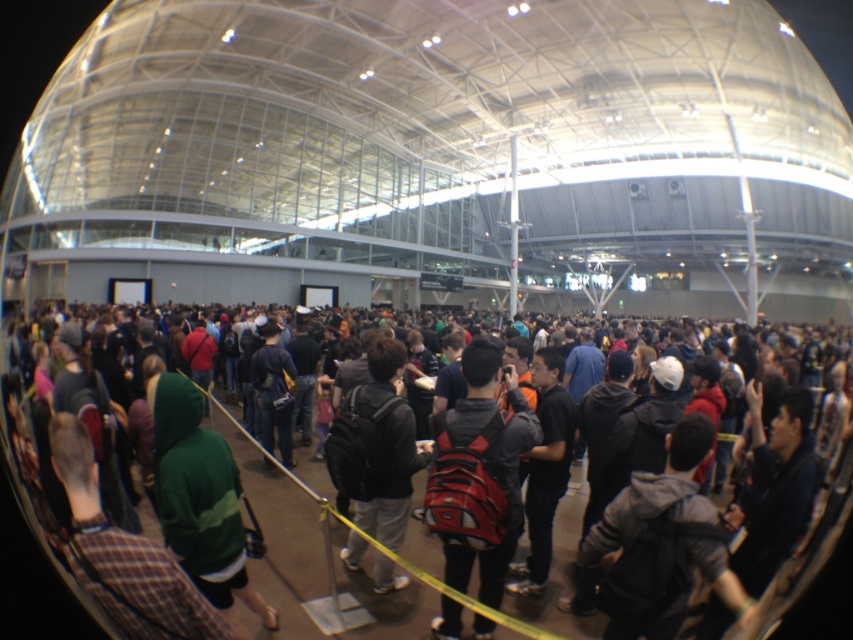
Question: Which point appears farthest from the camera in this image?

Choices:
 (A) (485, 422)
 (B) (358, 432)
 (C) (291, 579)

Answer: (C)

Question: Estimate the real-world distances between objects in this image. Which object is farther from the dark green hoodie at center?

Choices:
 (A) dark gray backpack at center
 (B) red backpack at center

Answer: (B)

Question: Can you confirm if dark green hoodie at center is positioned below red backpack at center?

Choices:
 (A) no
 (B) yes

Answer: (B)

Question: Is dark green hoodie at center above dark gray backpack at center?

Choices:
 (A) yes
 (B) no

Answer: (A)

Question: Considering the real-world distances, which object is closest to the red backpack at center?

Choices:
 (A) dark green hoodie at center
 (B) dark gray backpack at center

Answer: (B)

Question: Can you confirm if red backpack at center is smaller than dark gray backpack at center?

Choices:
 (A) no
 (B) yes

Answer: (B)